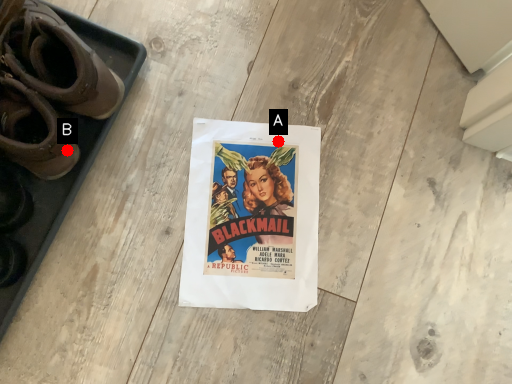
Question: Two points are circled on the image, labeled by A and B beside each circle. Which point is closer to the camera?

Choices:
 (A) A is closer
 (B) B is closer

Answer: (B)